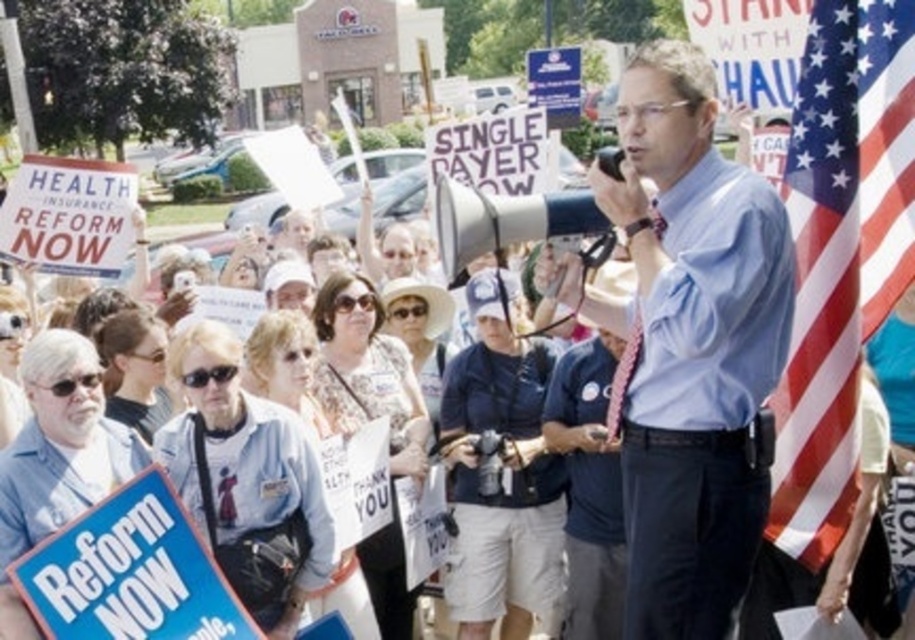
Can you confirm if light blue shirt at center is taller than blue cardboard placard at lower left?

Indeed, light blue shirt at center has a greater height compared to blue cardboard placard at lower left.

Can you confirm if light blue shirt at center is bigger than blue cardboard placard at lower left?

Correct, light blue shirt at center is larger in size than blue cardboard placard at lower left.

Is point (622, 493) in front of point (160, 472)?

No.

Identify the location of light blue shirt at center. pos(689,344).

Measure the distance between light blue shirt at center and american flag at right.

light blue shirt at center is 11.91 feet from american flag at right.

Is light blue shirt at center to the left of american flag at right from the viewer's perspective?

Indeed, light blue shirt at center is positioned on the left side of american flag at right.

Who is more distant from viewer, (674,440) or (851,234)?

Point (851,234)

You are a GUI agent. You are given a task and a screenshot of the screen. Output one action in this format:
    pyautogui.click(x=<x>, y=<y>)
    Task: Click on the light blue shirt at center
    
    Given the screenshot: What is the action you would take?
    pyautogui.click(x=689, y=344)

Is american flag at right further to camera compared to blue cardboard placard at lower left?

Yes, it is.

Who is lower down, american flag at right or blue cardboard placard at lower left?

blue cardboard placard at lower left is below.

Find the location of a particular element. The width and height of the screenshot is (915, 640). american flag at right is located at coordinates (840, 253).